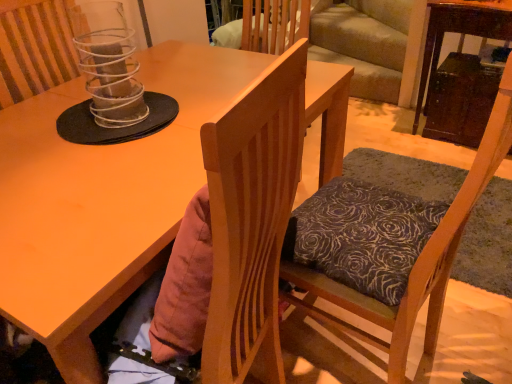
The image size is (512, 384). Identify the location of space that is in front of clear plastic spiral at upper center. (101, 154).